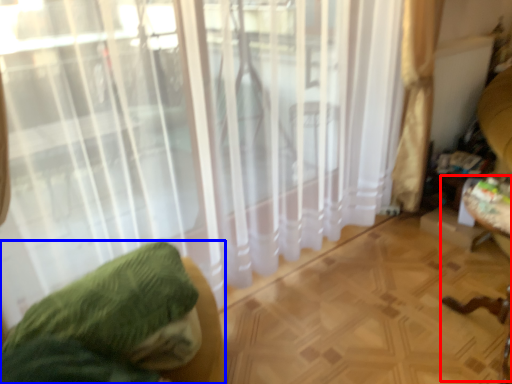
Question: Among these objects, which one is nearest to the camera, swivel chair (highlighted by a red box) or furniture (highlighted by a blue box)?

Choices:
 (A) swivel chair
 (B) furniture

Answer: (B)